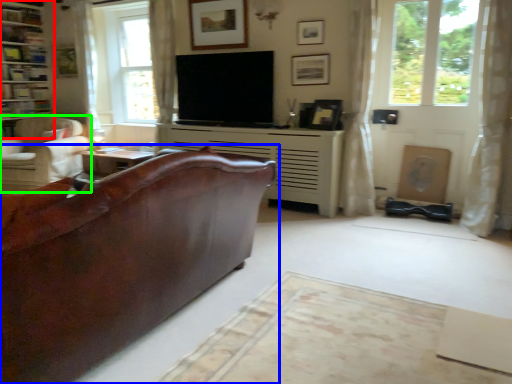
Question: Estimate the real-world distances between objects in this image. Which object is farther from tv cabinet (highlighted by a red box), studio couch (highlighted by a blue box) or chair (highlighted by a green box)?

Choices:
 (A) studio couch
 (B) chair

Answer: (A)